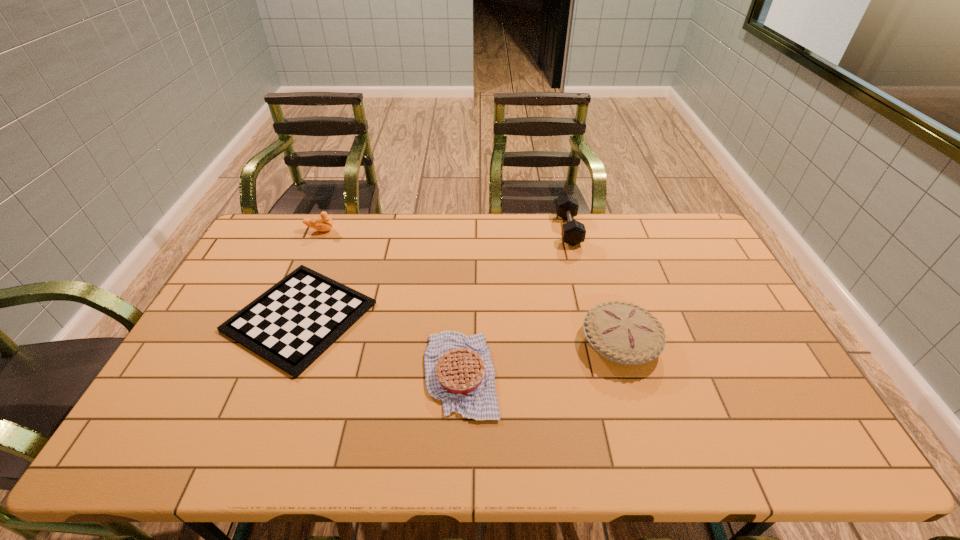
Find the location of a particular element. The height and width of the screenshot is (540, 960). vacant region located on the back of the checkerboard is located at coordinates (329, 241).

Identify the location of dumbbell located at the far edge. (573, 232).

What are the coordinates of `duckling present at the far edge` in the screenshot? It's located at (324, 223).

Find the location of `object present at the left edge`. object present at the left edge is located at coordinates (290, 325).

This screenshot has width=960, height=540. I want to click on free space at the far edge of the desktop, so click(637, 220).

This screenshot has width=960, height=540. What are the coordinates of `free space at the near edge of the desktop` in the screenshot? It's located at (658, 428).

You are a GUI agent. You are given a task and a screenshot of the screen. Output one action in this format:
    pyautogui.click(x=<x>, y=<y>)
    Task: Click on the free location at the right edge
    
    Given the screenshot: What is the action you would take?
    pyautogui.click(x=697, y=274)

The height and width of the screenshot is (540, 960). What are the coordinates of `free space at the far right corner of the desktop` in the screenshot? It's located at (654, 223).

What are the coordinates of `free spot at the near right corner of the desktop` in the screenshot? It's located at (798, 431).

Where is `free space between the checkerboard and the third object from right to left`? free space between the checkerboard and the third object from right to left is located at coordinates (380, 345).